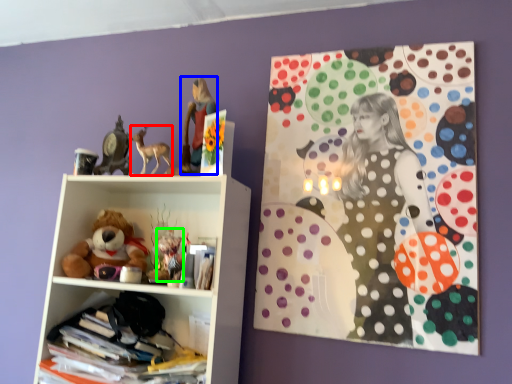
Question: Which object is the closest to the animal (highlighted by a red box)? Choose among these: girl (highlighted by a blue box) or toy (highlighted by a green box).

Choices:
 (A) girl
 (B) toy

Answer: (A)